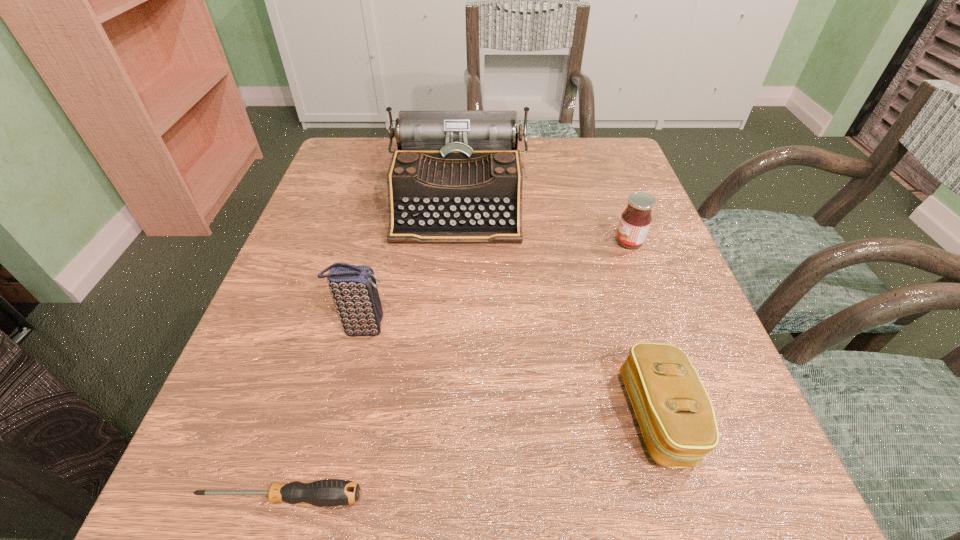
At what (x,y) coordinates should I click in order to perform the action: click on typewriter. Please return your answer as a coordinate pair (x, y). The width and height of the screenshot is (960, 540). Looking at the image, I should click on (456, 177).

You are a GUI agent. You are given a task and a screenshot of the screen. Output one action in this format:
    pyautogui.click(x=<x>, y=<y>)
    Task: Click on the left clutch bag
    The image size is (960, 540).
    Given the screenshot: What is the action you would take?
    pyautogui.click(x=355, y=293)

You are a GUI agent. You are given a task and a screenshot of the screen. Output one action in this format:
    pyautogui.click(x=<x>, y=<y>)
    Task: Click on the taller clutch bag
    This screenshot has width=960, height=540.
    Given the screenshot: What is the action you would take?
    pyautogui.click(x=355, y=293)

The image size is (960, 540). Find the location of `the third shortest object`. the third shortest object is located at coordinates click(x=635, y=221).

What are the coordinates of `the nearer clutch bag` in the screenshot? It's located at (675, 414).

Identify the location of the shorter clutch bag. (675, 414).

What are the coordinates of `the nearest object` in the screenshot? It's located at (330, 492).

At what (x,y) coordinates should I click in order to perform the action: click on the shortest object. Please return your answer as a coordinate pair (x, y). The height and width of the screenshot is (540, 960). Looking at the image, I should click on (330, 492).

Image resolution: width=960 pixels, height=540 pixels. What are the coordinates of `free point located on the keyboard of the tallest object` in the screenshot? It's located at (446, 403).

This screenshot has width=960, height=540. Identify the location of free space located with the zip open on the second tallest object. pyautogui.click(x=448, y=327).